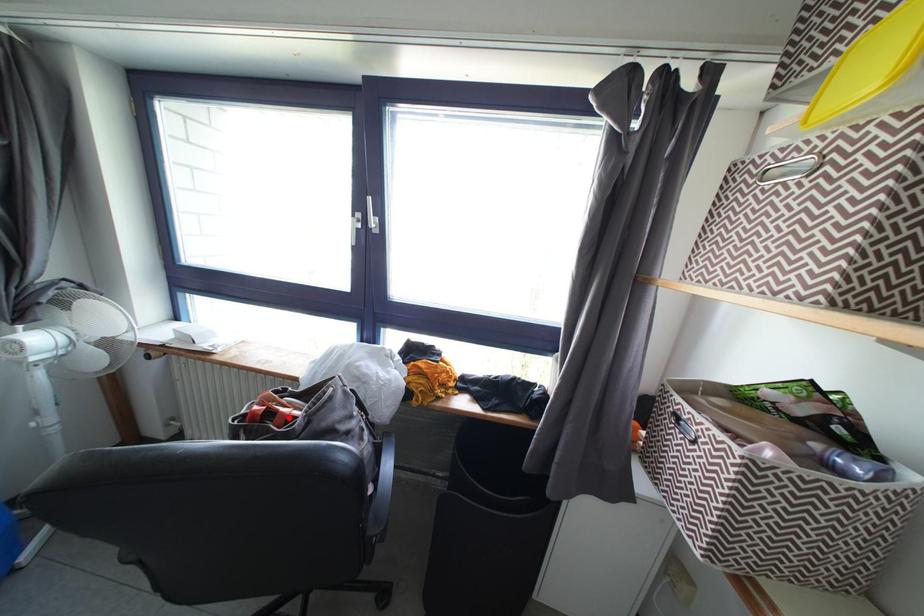
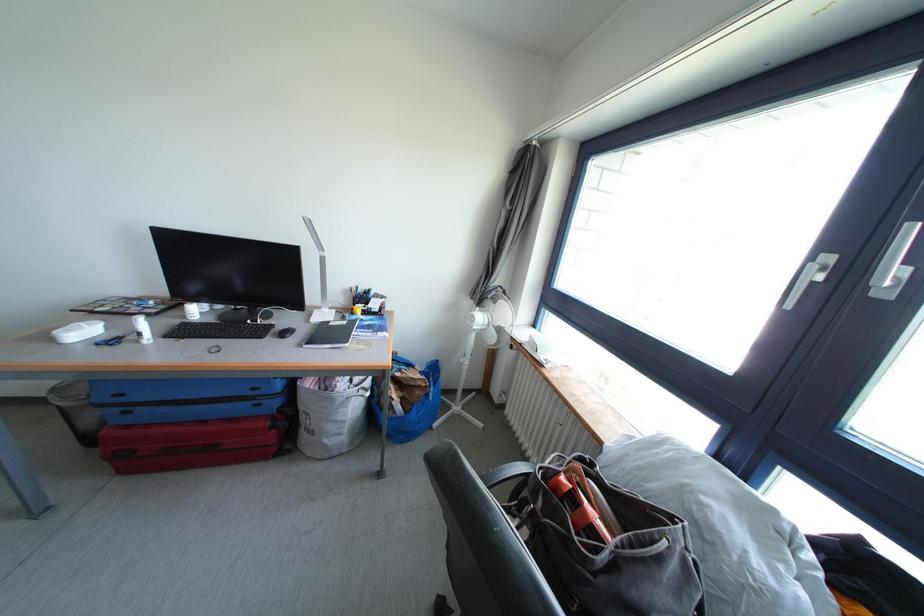
The point at the highlighted location is marked in the first image. Where is the corresponding point in the second image?

(591, 517)